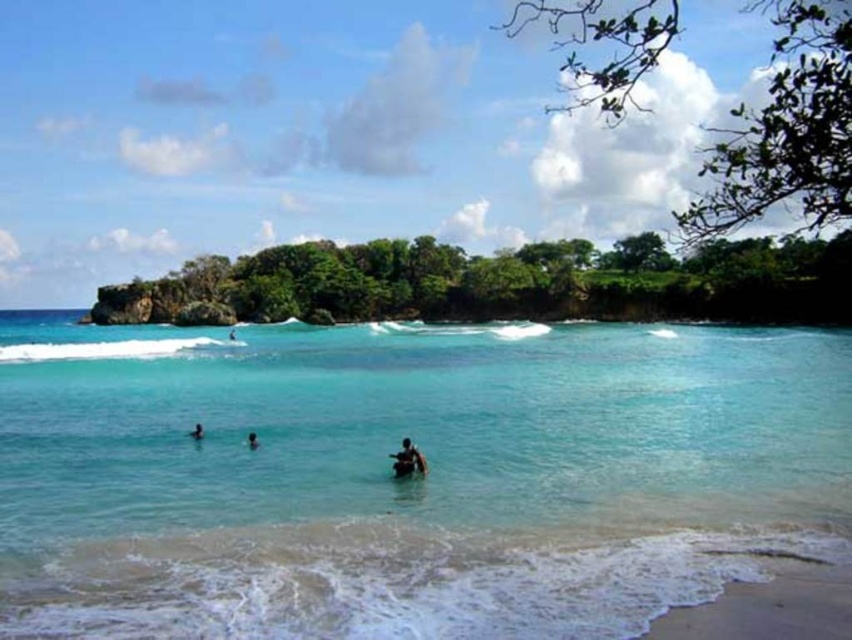
You are a photographer standing on the beach and want to capture both the smooth skin person at center and the smooth skin person at lower center in a single photo. Based on their sizes in the image, which person would appear larger in the photo?

The smooth skin person at center would appear larger in the photo because they are much taller than the smooth skin person at lower center.

You are a photographer standing on the beach. You want to take a photo that includes both the smooth skin person at center and the smooth skin person at lower center. Which person should you position to your left to frame them properly?

To frame them properly, you should position the smooth skin person at lower center to your left since the smooth skin person at center is on the right side of the smooth skin person at lower center.